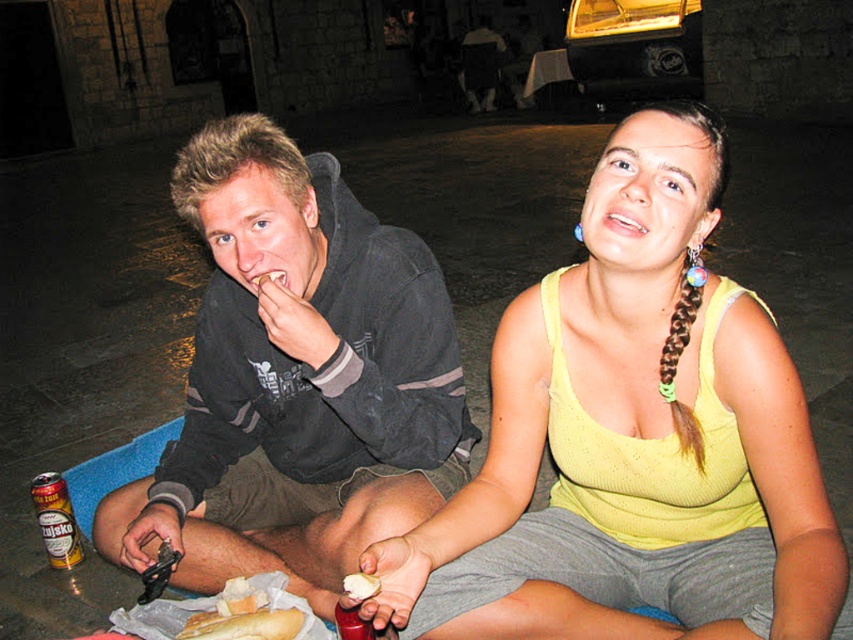
Question: Among these objects, which one is farthest from the camera?

Choices:
 (A) gold metallic can at lower left
 (B) yellow knitted tank top at center

Answer: (A)

Question: Is gold metallic can at lower left positioned in front of white glossy teeth at upper center?

Choices:
 (A) yes
 (B) no

Answer: (B)

Question: Can you confirm if yellow knitted tank top at center is thinner than gold metallic can at lower left?

Choices:
 (A) yes
 (B) no

Answer: (B)

Question: Which is farther from the white glossy teeth at upper center?

Choices:
 (A) gold metallic can at lower left
 (B) dark gray hoodie at center
 (C) yellow knitted tank top at center

Answer: (A)

Question: Which point appears farthest from the camera in this image?

Choices:
 (A) (x=466, y=499)
 (B) (x=201, y=449)

Answer: (B)

Question: Can you confirm if dark gray hoodie at center is bigger than yellow knitted tank top at center?

Choices:
 (A) no
 (B) yes

Answer: (B)